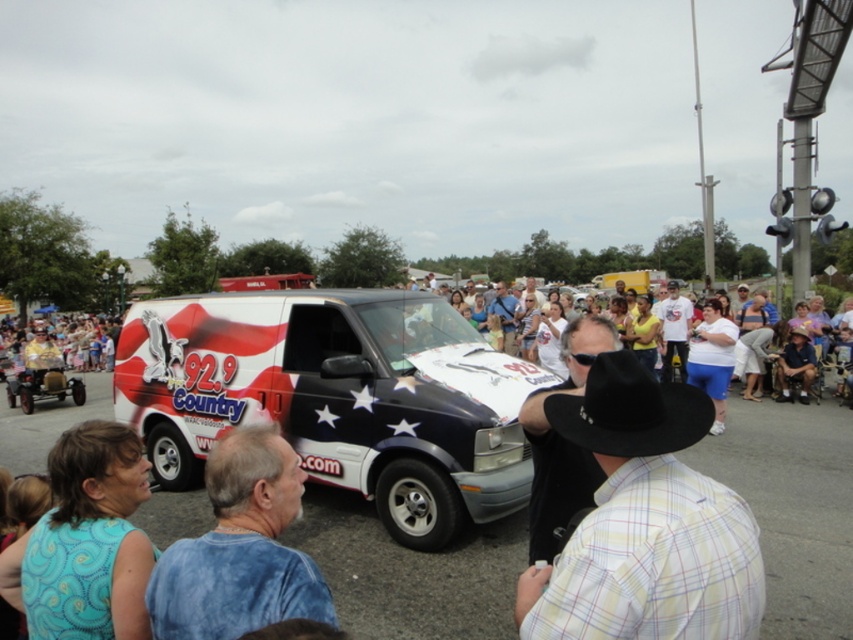
Measure the distance between painted vinyl van at center and black felt cowboy hat at center.

The distance of painted vinyl van at center from black felt cowboy hat at center is 13.89 feet.

Is painted vinyl van at center to the right of black felt cowboy hat at center from the viewer's perspective?

Incorrect, painted vinyl van at center is not on the right side of black felt cowboy hat at center.

Is point (318, 346) more distant than point (606, 451)?

That is True.

At what (x,y) coordinates should I click in order to perform the action: click on painted vinyl van at center. Please return your answer as a coordinate pair (x, y). This screenshot has height=640, width=853. Looking at the image, I should click on (337, 397).

Between plaid cotton shirt at center and teal fabric dress at lower left, which one has more height?

plaid cotton shirt at center

Does plaid cotton shirt at center appear over teal fabric dress at lower left?

Indeed, plaid cotton shirt at center is positioned over teal fabric dress at lower left.

Which is behind, point (693, 499) or point (138, 481)?

Positioned behind is point (138, 481).

This screenshot has height=640, width=853. I want to click on plaid cotton shirt at center, so click(x=645, y=524).

Is black felt cowboy hat at center to the right of white cotton shirt at left from the viewer's perspective?

Yes, black felt cowboy hat at center is to the right of white cotton shirt at left.

Who is more forward, (570, 403) or (9, 353)?

Point (570, 403)

This screenshot has width=853, height=640. Find the location of `black felt cowboy hat at center`. black felt cowboy hat at center is located at coordinates (630, 410).